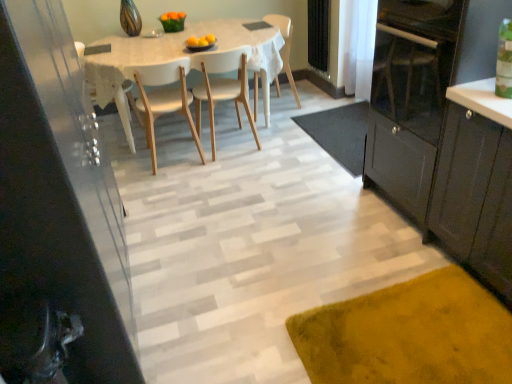
Question: From a real-world perspective, relative to matte black cabinet at left, which is the first cabinetry in left-to-right order, is white matte chair at center, placed as the first chair when sorted from left to right, vertically above or below?

Choices:
 (A) below
 (B) above

Answer: (A)

Question: Is white matte chair at center, which is the third chair in right-to-left order, bigger or smaller than matte black cabinet at left, which is the first cabinetry in left-to-right order?

Choices:
 (A) big
 (B) small

Answer: (B)

Question: Estimate the real-world distances between objects in this image. Which object is farther from the black rubber doormat at center, which appears as the second doormat when ordered from the bottom?

Choices:
 (A) dark gray wood cabinet at right, the 1th cabinetry positioned from the right
 (B) white matte chair at center, which is the third chair in right-to-left order
 (C) white wood table at center
 (D) velvety yellow rug at lower right, which is the 1th doormat in front-to-back order
 (E) matte black cabinet at left, which is the first cabinetry in left-to-right order

Answer: (E)

Question: Considering the real-world distances, which object is farthest from the white sheer curtain at upper right?

Choices:
 (A) white wood chair at center, positioned as the first chair in right-to-left order
 (B) white wood table at center
 (C) white matte chair at center, placed as the first chair when sorted from left to right
 (D) matte black cabinet at left, marked as the second cabinetry in a right-to-left arrangement
 (E) black rubber doormat at center, marked as the first doormat in a back-to-front arrangement

Answer: (D)